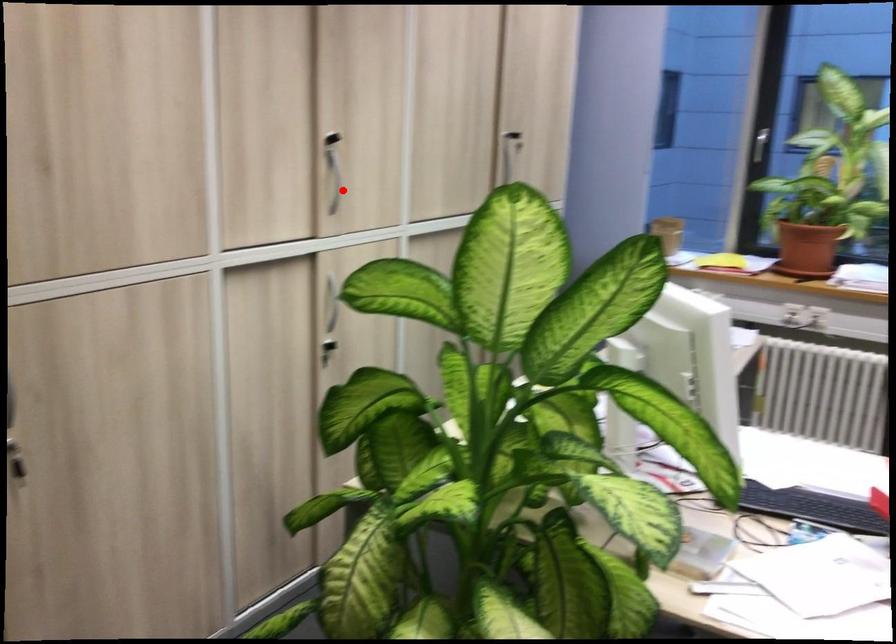
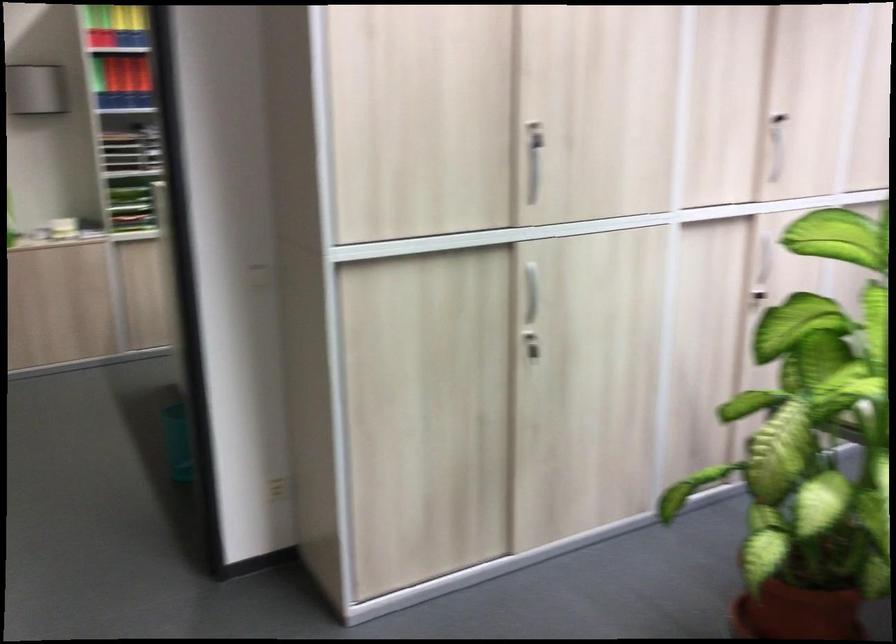
Question: I am providing you with two images of the same scene from different viewpoints. In image1, a red point is highlighted. Considering the same 3D point in image2, which of the following is correct?

Choices:
 (A) It is closer
 (B) It is farther

Answer: (B)